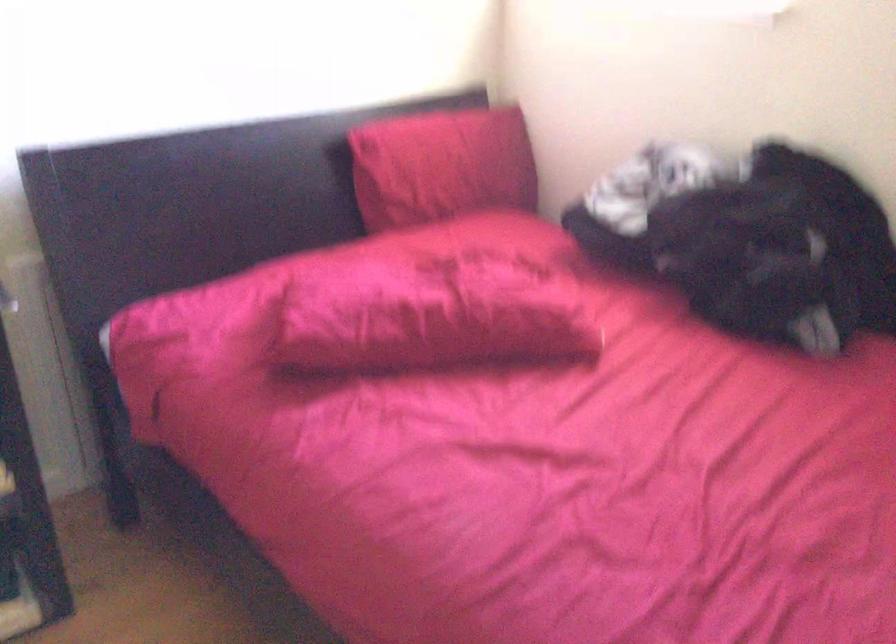
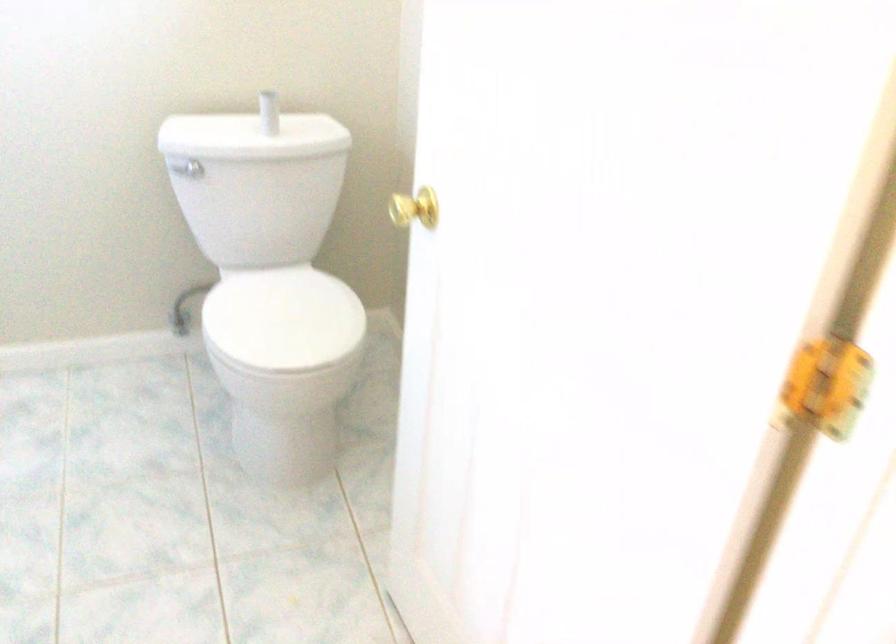
Question: In a continuous first-person perspective shot, in which direction is the camera moving?

Choices:
 (A) Left
 (B) Right
 (C) Forward
 (D) Backward

Answer: (A)